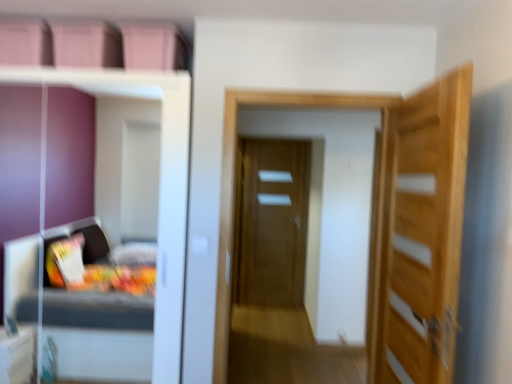
Question: Is light wood door at right, the 1th door from the front, shorter than transparent glass door at center?

Choices:
 (A) no
 (B) yes

Answer: (B)

Question: Is light wood door at right, arranged as the 1th door when viewed from the right, not within transparent glass door at center?

Choices:
 (A) yes
 (B) no

Answer: (A)

Question: Is light wood door at right, arranged as the 1th door when viewed from the right, positioned with its back to transparent glass door at center?

Choices:
 (A) yes
 (B) no

Answer: (B)

Question: Does light wood door at right, the 1th door from the front, appear on the left side of transparent glass door at center?

Choices:
 (A) yes
 (B) no

Answer: (B)

Question: Is light wood door at right, which is counted as the second door, starting from the left, positioned behind transparent glass door at center?

Choices:
 (A) yes
 (B) no

Answer: (B)

Question: Is transparent glass door at center inside the boundaries of light wood door at right, which is counted as the second door, starting from the left, or outside?

Choices:
 (A) outside
 (B) inside

Answer: (A)

Question: Is transparent glass door at center bigger or smaller than light wood door at right, which is counted as the second door, starting from the left?

Choices:
 (A) small
 (B) big

Answer: (B)

Question: Is transparent glass door at center taller or shorter than light wood door at right, arranged as the 1th door when viewed from the right?

Choices:
 (A) tall
 (B) short

Answer: (A)

Question: Relative to light wood door at right, which is counted as the second door, starting from the back, is transparent glass door at center in front or behind?

Choices:
 (A) behind
 (B) front

Answer: (A)

Question: Is white glossy dresser at left wider or thinner than light wood door at right, which is counted as the second door, starting from the back?

Choices:
 (A) wide
 (B) thin

Answer: (A)

Question: In terms of height, does white glossy dresser at left look taller or shorter compared to light wood door at right, the 1th door from the front?

Choices:
 (A) short
 (B) tall

Answer: (B)

Question: Is white glossy dresser at left bigger or smaller than light wood door at right, arranged as the 1th door when viewed from the right?

Choices:
 (A) small
 (B) big

Answer: (B)

Question: In the image, is white glossy dresser at left positioned in front of or behind light wood door at right, which is counted as the second door, starting from the left?

Choices:
 (A) behind
 (B) front

Answer: (A)

Question: Is point (435, 114) positioned closer to the camera than point (296, 96)?

Choices:
 (A) closer
 (B) farther

Answer: (A)

Question: From the image's perspective, relative to transparent glass door at center, is light wood door at right, which is counted as the second door, starting from the left, above or below?

Choices:
 (A) below
 (B) above

Answer: (A)